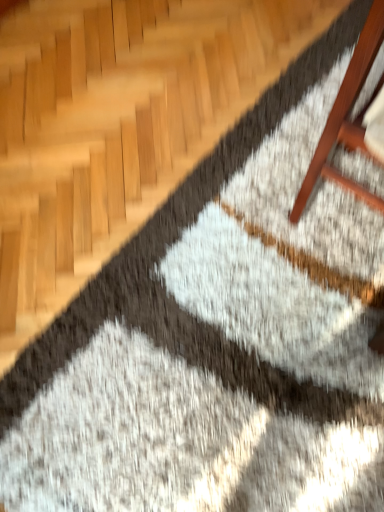
I want to click on wooden chair leg at upper right, so [x=346, y=119].

Measure the distance between point (x=344, y=121) and camera.

The depth of point (x=344, y=121) is 32.40 inches.

Describe the element at coordinates (346, 119) in the screenshot. I see `wooden chair leg at upper right` at that location.

You are a GUI agent. You are given a task and a screenshot of the screen. Output one action in this format:
    pyautogui.click(x=<x>, y=<y>)
    Task: Click on the wooden chair leg at upper right
    The height and width of the screenshot is (512, 384).
    Given the screenshot: What is the action you would take?
    pyautogui.click(x=346, y=119)